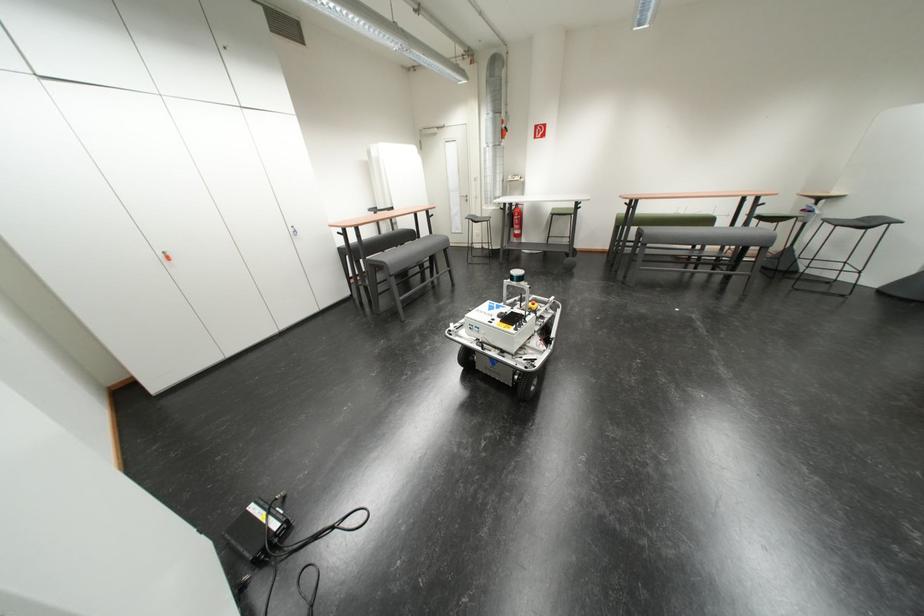
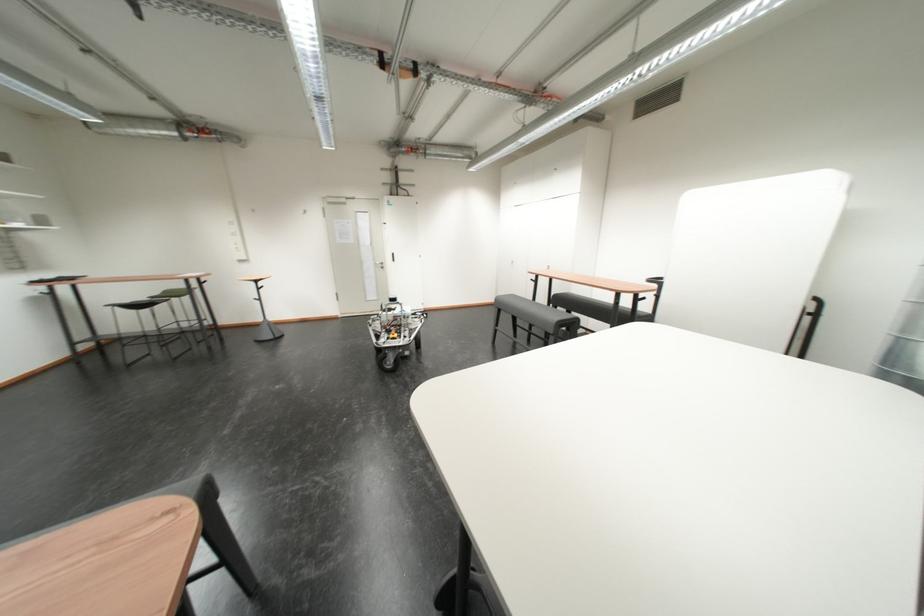
Question: I am providing you with two images of the same scene from different viewpoints. Please identify which objects are invisible in image2.

Choices:
 (A) silver door handle
 (B) white styrofoam block
 (C) fire extinguisher handle
 (D) grey sofa sitting surface

Answer: (C)